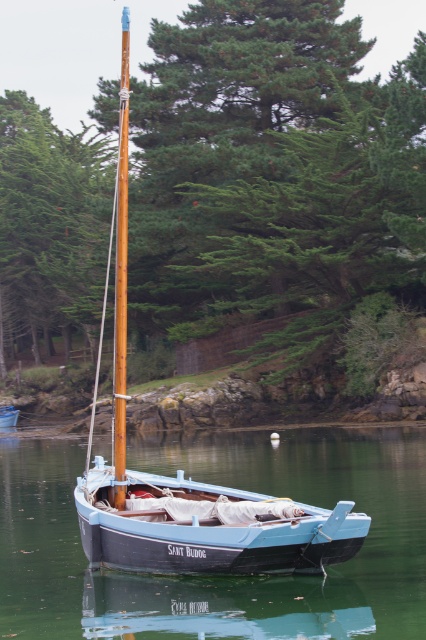
You are standing on the dock and looking out at the blue painted wood boat at center and the blue smooth water at center. Which object is closer to you?

The blue smooth water at center is closer to you because it is in front of the blue painted wood boat at center.

Based on the photo, you are a boat captain planning to navigate your vessel through a narrow channel. The channel is 80 feet wide. You observe the green textured tree at upper left and the wooden mast at center in the scene. Can your boat safely pass through the channel without touching either the tree or the mast?

The distance between the green textured tree at upper left and the wooden mast at center is 85.45 feet. Since the channel is 80 feet wide, the boat cannot safely pass through without risking contact with either the tree or the mast.

You are an observer standing on the dock looking at the green textured tree at upper left and the wooden mast at center. Which object appears taller in the scene?

The wooden mast at center appears taller than the green textured tree at upper left.